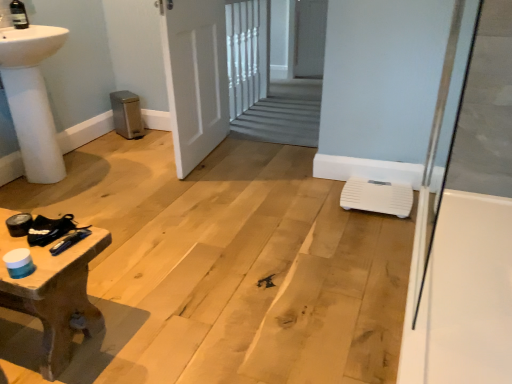
Find the location of `vacant space that's between white plastic scale at lower right and white glossy bath at right`. vacant space that's between white plastic scale at lower right and white glossy bath at right is located at coordinates (385, 242).